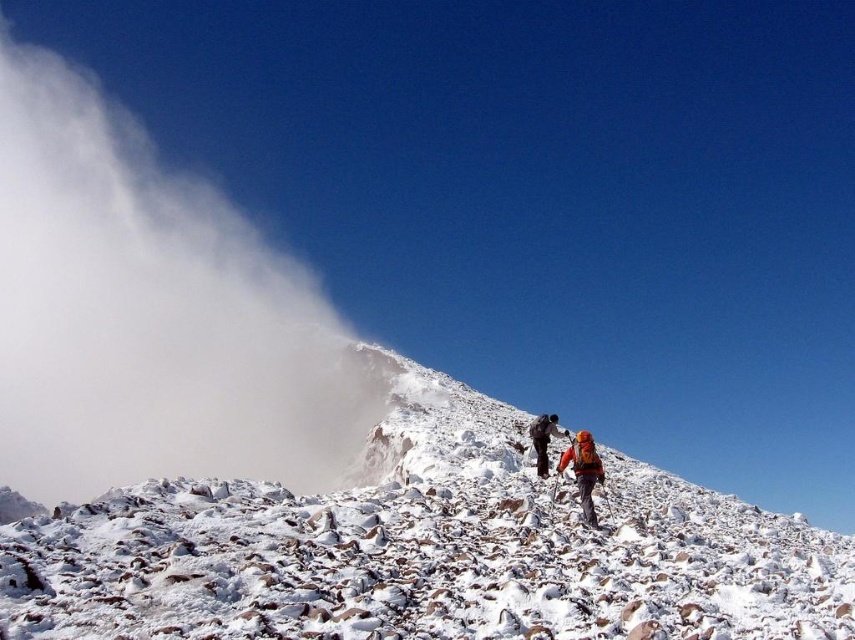
Question: Which object is the closest to the white rocky mountain at center?

Choices:
 (A) white fluffy cloud at upper left
 (B) orange fabric backpack at center
 (C) orange fabric jacket at center

Answer: (C)

Question: Does white rocky mountain at center have a greater width compared to orange fabric backpack at center?

Choices:
 (A) yes
 (B) no

Answer: (A)

Question: Observing the image, what is the correct spatial positioning of white rocky mountain at center in reference to orange fabric jacket at center?

Choices:
 (A) right
 (B) left

Answer: (B)

Question: Which of the following is the closest to the observer?

Choices:
 (A) (585, 438)
 (B) (93, 461)
 (C) (410, 422)
 (D) (529, 422)

Answer: (A)

Question: Which point is farther to the camera?

Choices:
 (A) (532, 422)
 (B) (308, 490)
 (C) (587, 451)
 (D) (396, 365)

Answer: (D)

Question: Considering the relative positions of orange fabric backpack at center and orange fabric jacket at center in the image provided, where is orange fabric backpack at center located with respect to orange fabric jacket at center?

Choices:
 (A) right
 (B) left

Answer: (A)